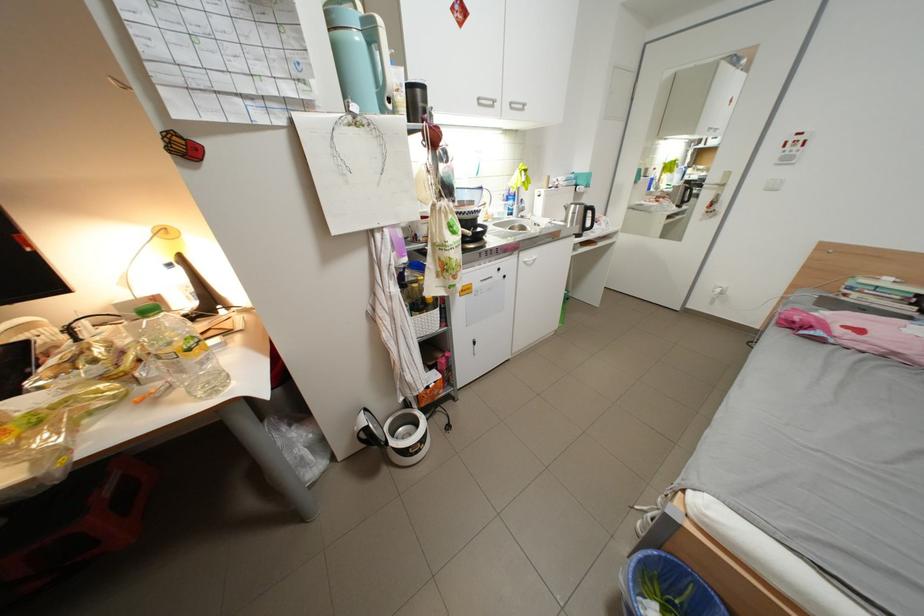
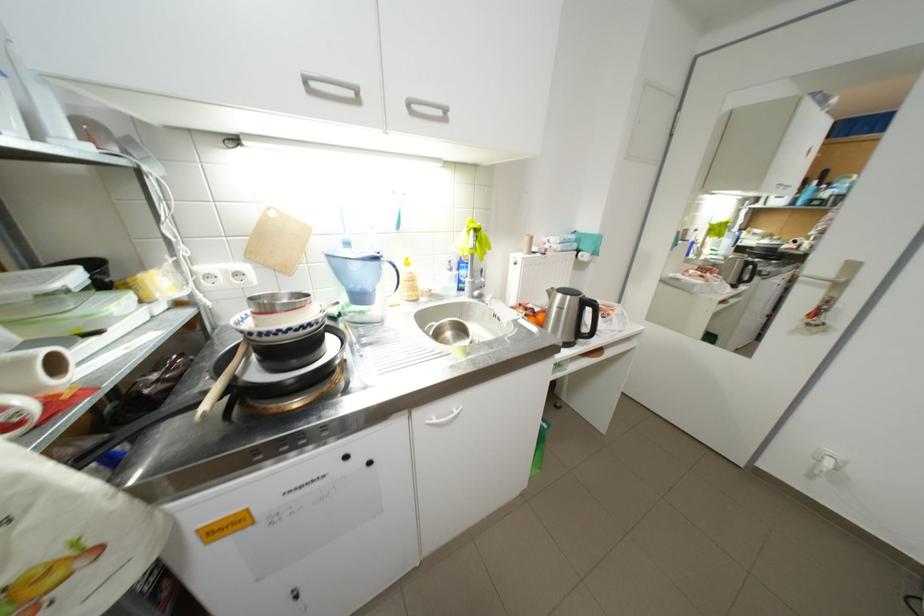
Find the pixel in the second image that matches the point at 490,100 in the first image.

(317, 79)